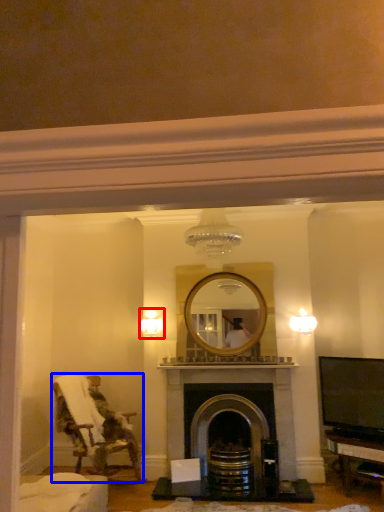
Question: Which point is closer to the camera, light fixture (highlighted by a red box) or chair (highlighted by a blue box)?

Choices:
 (A) light fixture
 (B) chair

Answer: (B)